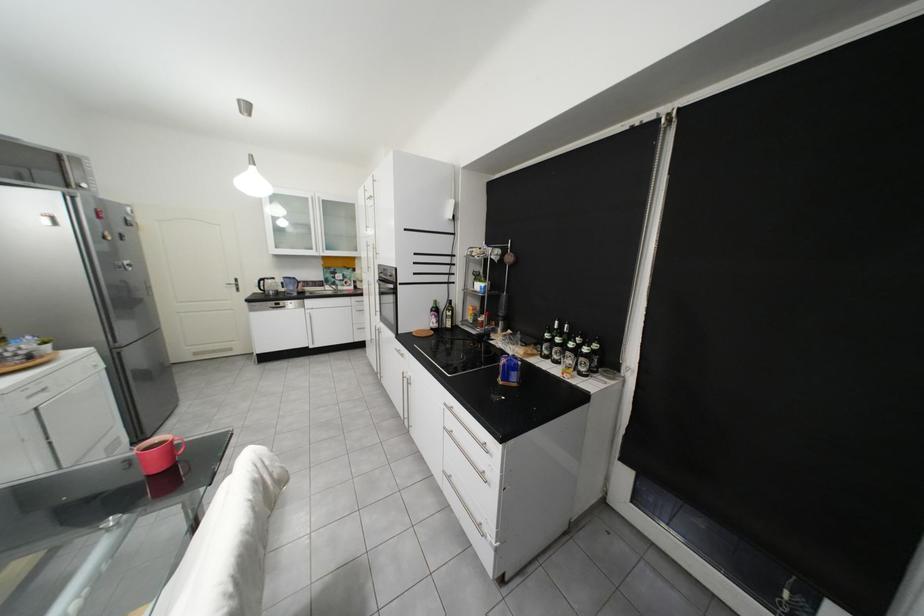
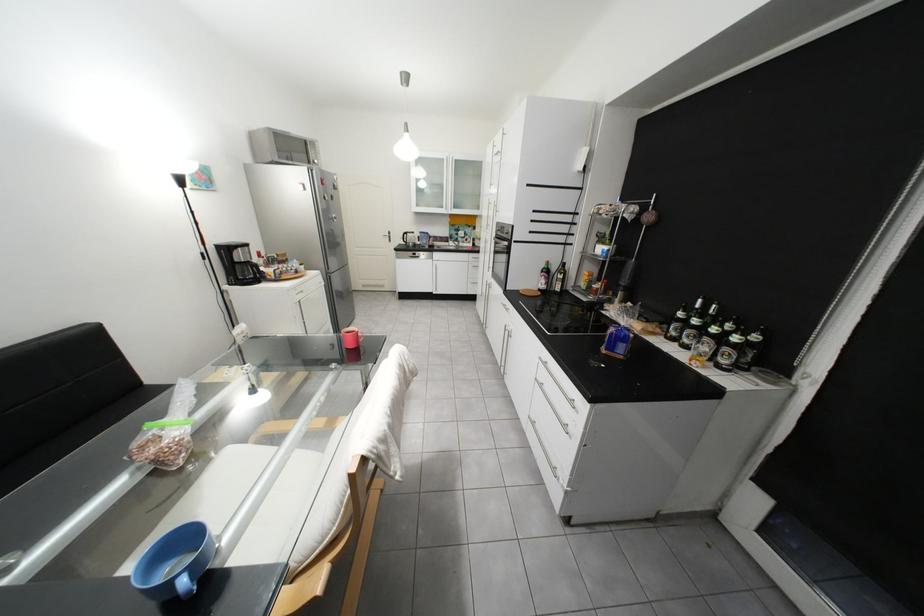
Question: The images are taken continuously from a first-person perspective. In which direction is your viewpoint rotating?

Choices:
 (A) Left
 (B) Right
 (C) Up
 (D) Down

Answer: (A)